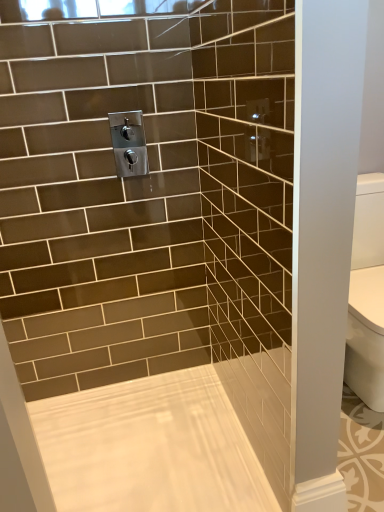
Question: Can you confirm if satin nickel faucet at upper center is taller than white glossy bathtub at center?

Choices:
 (A) yes
 (B) no

Answer: (A)

Question: Does satin nickel faucet at upper center appear on the right side of white glossy bathtub at center?

Choices:
 (A) yes
 (B) no

Answer: (B)

Question: Can we say satin nickel faucet at upper center lies outside white glossy bathtub at center?

Choices:
 (A) yes
 (B) no

Answer: (A)

Question: Is satin nickel faucet at upper center further to camera compared to white glossy bathtub at center?

Choices:
 (A) no
 (B) yes

Answer: (B)

Question: Does satin nickel faucet at upper center have a smaller size compared to white glossy bathtub at center?

Choices:
 (A) yes
 (B) no

Answer: (A)

Question: Is satin nickel faucet at upper center next to white glossy bathtub at center and touching it?

Choices:
 (A) no
 (B) yes

Answer: (A)

Question: From the image's perspective, is white glossy bathtub at center on top of satin nickel faucet at upper center?

Choices:
 (A) no
 (B) yes

Answer: (A)

Question: Does white glossy bathtub at center have a greater width compared to satin nickel faucet at upper center?

Choices:
 (A) yes
 (B) no

Answer: (A)

Question: Can you confirm if white glossy bathtub at center is shorter than satin nickel faucet at upper center?

Choices:
 (A) yes
 (B) no

Answer: (A)

Question: Is white glossy bathtub at center positioned with its back to satin nickel faucet at upper center?

Choices:
 (A) yes
 (B) no

Answer: (B)

Question: Can you confirm if white glossy bathtub at center is positioned to the left of satin nickel faucet at upper center?

Choices:
 (A) no
 (B) yes

Answer: (A)

Question: Would you say satin nickel faucet at upper center is part of white glossy bathtub at center's contents?

Choices:
 (A) no
 (B) yes

Answer: (A)

Question: Is point (132, 424) closer or farther from the camera than point (115, 164)?

Choices:
 (A) farther
 (B) closer

Answer: (A)